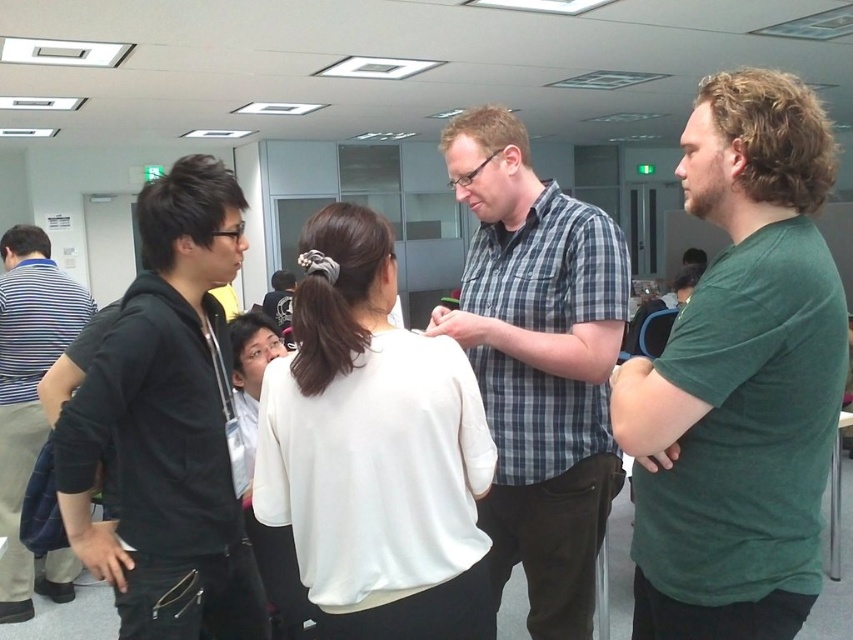
You are standing in the middle of the room and want to hand a document to the person wearing the striped cotton shirt at left. The white matte shirt at center is blocking your path. Can you walk around them without getting too close? Please explain your reasoning based on the distance between the two shirts.

The white matte shirt at center is 2.45 meters away from the striped cotton shirt at left. Since you are in the middle, you can walk around the white matte shirt at center to reach the striped cotton shirt at left while maintaining a safe distance of approximately 1.225 meters from each, which should be sufficient to avoid getting too close.

Looking at this image, you are organizing a group photo and need to arrange the green matte shirt at right and plaid shirt at center according to their current positions. Which shirt should be placed to the right side in the photo?

The green matte shirt at right should be placed to the right side in the photo because it is currently positioned to the right of the plaid shirt at center.

You are organizing a photo shoot and need to arrange two shirts on a mannequin. The white matte shirt at center and the striped cotton shirt at left must be placed side by side. Based on their sizes, which shirt should be placed on the right side to ensure proper visibility?

The white matte shirt at center should be placed on the right side because it might be wider than the striped cotton shirt at left, ensuring it doesn t get obscured.